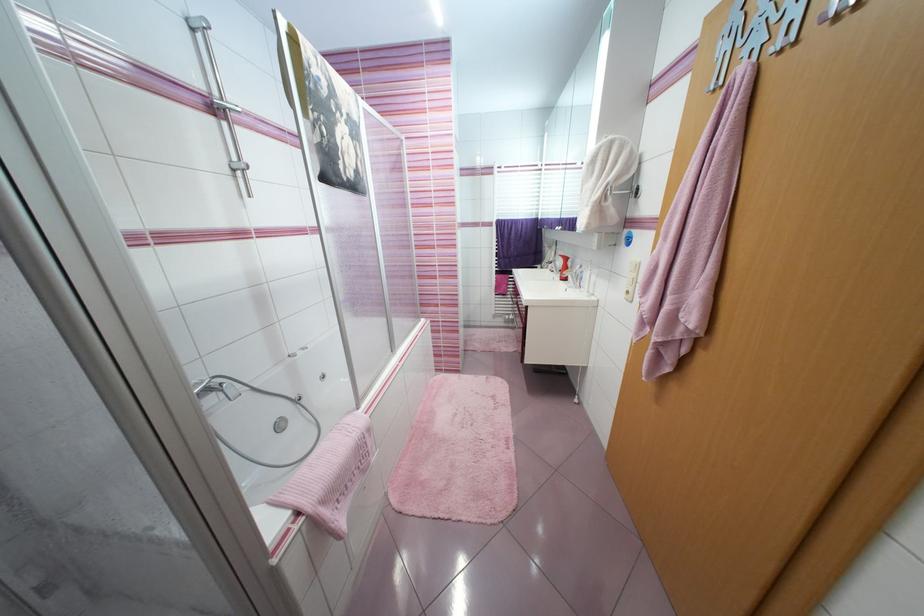
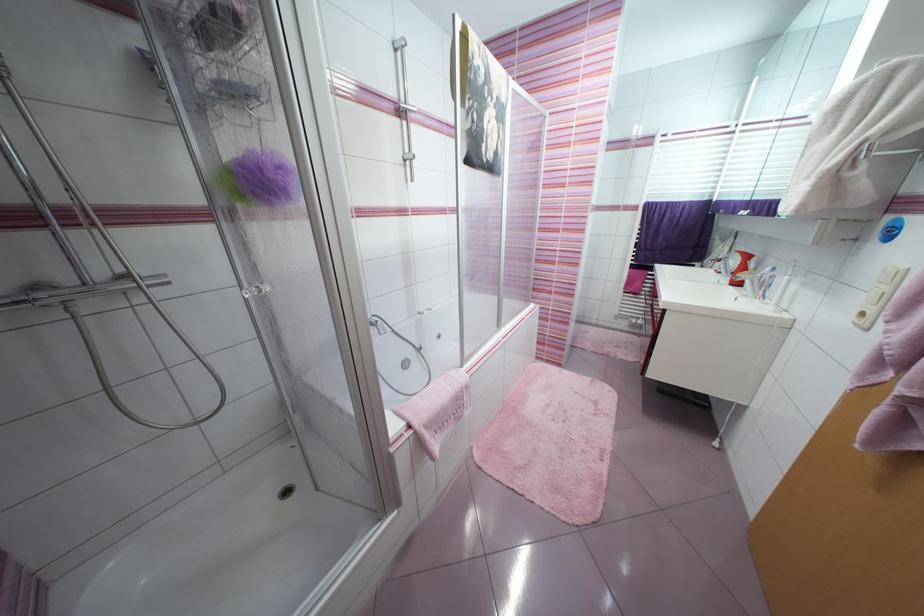
Question: What movement of the cameraman would produce the second image?

Choices:
 (A) Left
 (B) Right
 (C) Forward
 (D) Backward

Answer: (D)